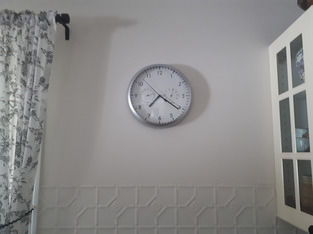
Locate an element on the screen. This screenshot has height=234, width=313. minute hand on the clock is located at coordinates (168, 102).